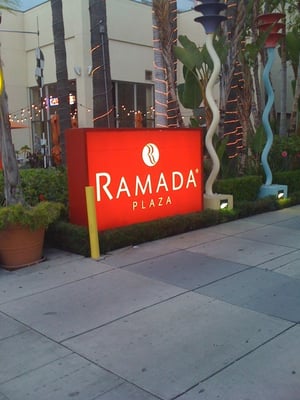
Locate an element on the screen. This screenshot has width=300, height=400. planter is located at coordinates (22, 238).